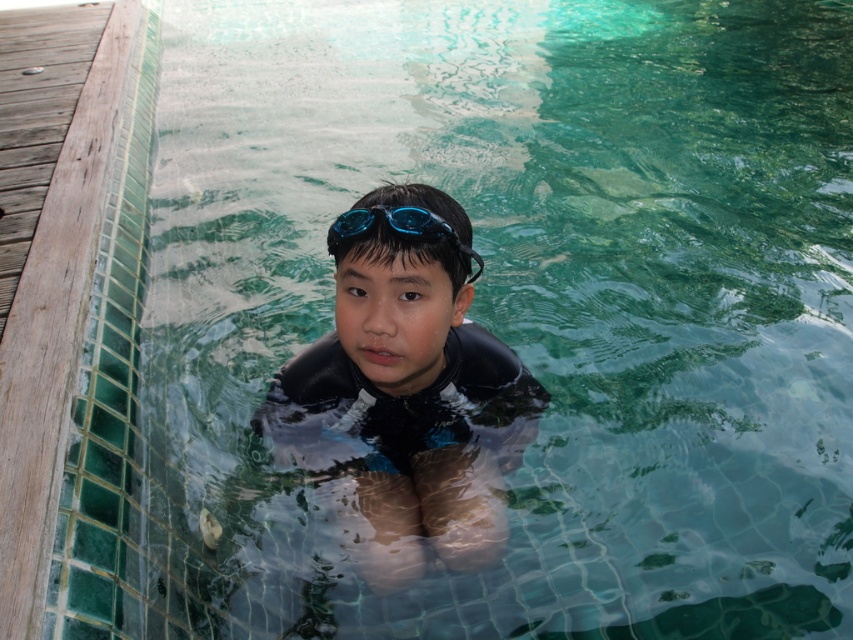
You are a lifeguard observing the scene. You notice the black matte wetsuit at center and the blue matte swimming goggles at center. Which object is closer to the water surface?

The blue matte swimming goggles at center is closer to the water surface because it is positioned above the black matte wetsuit at center.